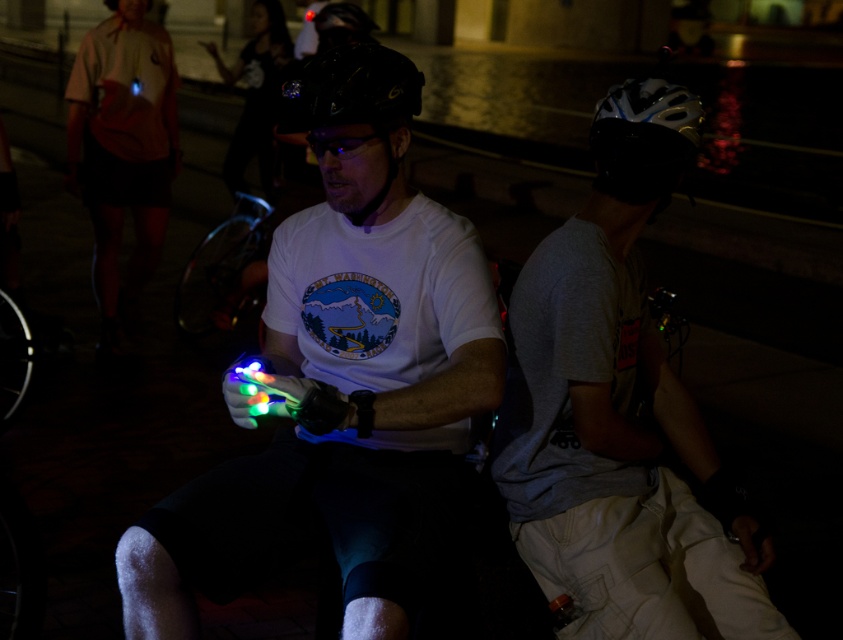
Who is higher up, matte orange shirt at upper left or black matte helmet at center?

matte orange shirt at upper left is above.

Can you confirm if matte orange shirt at upper left is bigger than black matte helmet at center?

Yes.

Find the location of `matte orange shirt at upper left`. matte orange shirt at upper left is located at coordinates (122, 152).

Does white matte t-shirt at center appear over white matte bicycle helmet at upper right?

Incorrect, white matte t-shirt at center is not positioned above white matte bicycle helmet at upper right.

Between white matte t-shirt at center and white matte bicycle helmet at upper right, which one has less height?

Standing shorter between the two is white matte bicycle helmet at upper right.

Is point (455, 406) more distant than point (643, 120)?

No, (455, 406) is in front of (643, 120).

Locate an element on the screen. The height and width of the screenshot is (640, 843). white matte t-shirt at center is located at coordinates (344, 380).

Does white matte t-shirt at center appear under gray fabric shirt at right?

Incorrect, white matte t-shirt at center is not positioned below gray fabric shirt at right.

Which is behind, point (417, 540) or point (619, 179)?

Positioned behind is point (619, 179).

Between point (498, 342) and point (605, 547), which one is positioned in front?

Point (498, 342) is in front.

This screenshot has width=843, height=640. I want to click on white matte t-shirt at center, so click(344, 380).